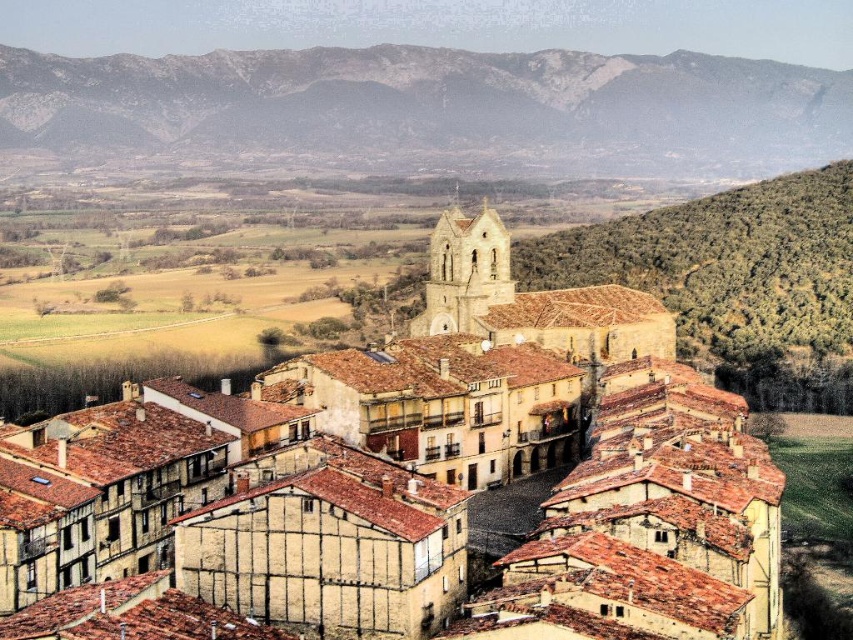
Does point (380, 608) lie behind point (97, 147)?

No, (380, 608) is in front of (97, 147).

Can you confirm if brown clay roof tiles at center is positioned below rugged stone mountain at upper left?

Indeed, brown clay roof tiles at center is positioned under rugged stone mountain at upper left.

Where is `brown clay roof tiles at center`? brown clay roof tiles at center is located at coordinates (415, 474).